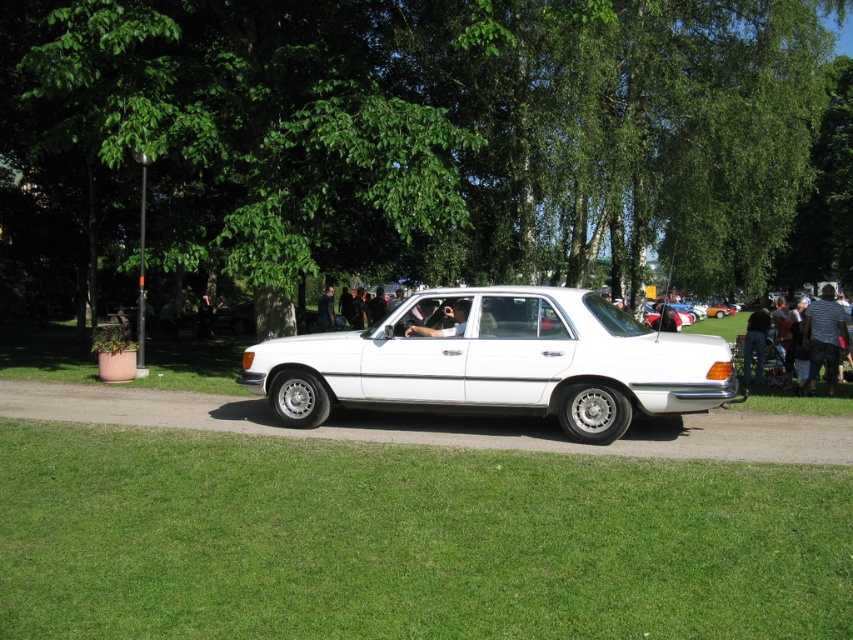
Question: Which object is closer to the camera taking this photo?

Choices:
 (A) white glossy sedan at center
 (B) green grass at lower center

Answer: (B)

Question: Does green grass at lower center appear on the left side of white glossy sedan at center?

Choices:
 (A) no
 (B) yes

Answer: (A)

Question: Does green grass at lower center appear on the right side of matte black car door at center?

Choices:
 (A) yes
 (B) no

Answer: (A)

Question: Does striped shirt at right appear on the right side of matte black car door at center?

Choices:
 (A) no
 (B) yes

Answer: (B)

Question: Which of these objects is positioned closest to the matte black car door at center?

Choices:
 (A) white glossy sedan at center
 (B) striped shirt at right
 (C) green grass at lower center

Answer: (A)

Question: Which object is farther from the camera taking this photo?

Choices:
 (A) green grass at lower center
 (B) striped shirt at right
 (C) white glossy sedan at center

Answer: (B)